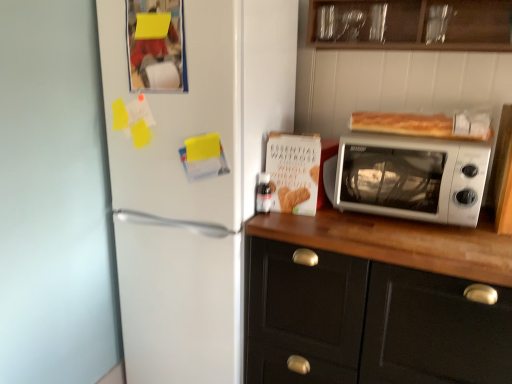
Question: Can you confirm if white plastic microwave at upper right is positioned to the left of wooden cabinet at upper center, the first cabinetry when ordered from top to bottom?

Choices:
 (A) yes
 (B) no

Answer: (B)

Question: Is white plastic microwave at upper right far away from wooden cabinet at upper center, arranged as the second cabinetry when ordered from the bottom?

Choices:
 (A) yes
 (B) no

Answer: (B)

Question: Is the position of white plastic microwave at upper right more distant than that of wooden cabinet at upper center, the first cabinetry when ordered from top to bottom?

Choices:
 (A) no
 (B) yes

Answer: (B)

Question: Is white plastic microwave at upper right to the right of wooden cabinet at upper center, arranged as the second cabinetry when ordered from the bottom, from the viewer's perspective?

Choices:
 (A) no
 (B) yes

Answer: (B)

Question: Is white plastic microwave at upper right not within wooden cabinet at upper center, the first cabinetry when ordered from top to bottom?

Choices:
 (A) yes
 (B) no

Answer: (A)

Question: Based on their sizes in the image, would you say white matte cabinet at right, arranged as the 2th cabinetry when viewed from the top, is bigger or smaller than white plastic microwave at upper right?

Choices:
 (A) big
 (B) small

Answer: (A)

Question: Choose the correct answer: Is white matte cabinet at right, positioned as the 1th cabinetry in bottom-to-top order, inside white plastic microwave at upper right or outside it?

Choices:
 (A) outside
 (B) inside

Answer: (A)

Question: From the image's perspective, is white matte cabinet at right, arranged as the 2th cabinetry when viewed from the top, located above or below white plastic microwave at upper right?

Choices:
 (A) above
 (B) below

Answer: (B)

Question: From a real-world perspective, is white matte cabinet at right, arranged as the 2th cabinetry when viewed from the top, above or below white plastic microwave at upper right?

Choices:
 (A) above
 (B) below

Answer: (B)

Question: Considering their positions, is wooden cabinet at upper center, arranged as the second cabinetry when ordered from the bottom, located in front of or behind golden brown crusty bread at upper right?

Choices:
 (A) behind
 (B) front

Answer: (B)

Question: In terms of width, does wooden cabinet at upper center, the first cabinetry when ordered from top to bottom, look wider or thinner when compared to golden brown crusty bread at upper right?

Choices:
 (A) wide
 (B) thin

Answer: (A)

Question: Is wooden cabinet at upper center, arranged as the second cabinetry when ordered from the bottom, spatially inside golden brown crusty bread at upper right, or outside of it?

Choices:
 (A) outside
 (B) inside

Answer: (A)

Question: From their relative heights in the image, would you say wooden cabinet at upper center, arranged as the second cabinetry when ordered from the bottom, is taller or shorter than golden brown crusty bread at upper right?

Choices:
 (A) tall
 (B) short

Answer: (A)

Question: Based on their sizes in the image, would you say golden brown crusty bread at upper right is bigger or smaller than white plastic microwave at upper right?

Choices:
 (A) big
 (B) small

Answer: (B)

Question: From a real-world perspective, is golden brown crusty bread at upper right positioned above or below white plastic microwave at upper right?

Choices:
 (A) above
 (B) below

Answer: (A)